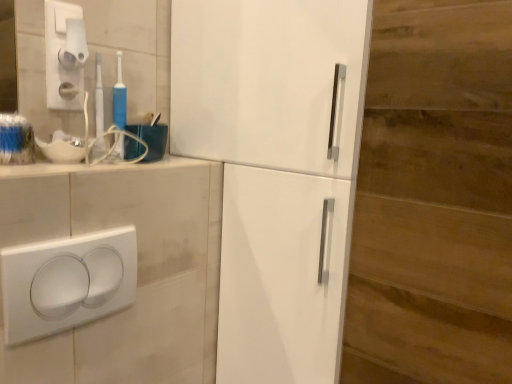
This screenshot has width=512, height=384. Find the location of `white plastic toothbrush at upper left, arranged as the 2th toothbrush when viewed from the right`. white plastic toothbrush at upper left, arranged as the 2th toothbrush when viewed from the right is located at coordinates (99, 110).

Locate an element on the screen. This screenshot has height=384, width=512. white glossy cabinet at center is located at coordinates (275, 170).

What do you see at coordinates (275, 170) in the screenshot?
I see `white glossy cabinet at center` at bounding box center [275, 170].

Describe the element at coordinates (65, 55) in the screenshot. The width and height of the screenshot is (512, 384). I see `white plastic light switch at upper left, marked as the 2th light switch in a front-to-back arrangement` at that location.

I want to click on white plastic/light switch at lower left, acting as the 1th light switch starting from the bottom, so click(x=67, y=282).

How distant is white plastic/light switch at lower left, which ranks as the second light switch in back-to-front order, from white plastic toothbrush at upper left, arranged as the 2th toothbrush when viewed from the right?

white plastic/light switch at lower left, which ranks as the second light switch in back-to-front order, is 10.43 inches away from white plastic toothbrush at upper left, arranged as the 2th toothbrush when viewed from the right.

Is white plastic/light switch at lower left, which ranks as the second light switch in back-to-front order, not close to white plastic toothbrush at upper left, arranged as the 2th toothbrush when viewed from the right?

white plastic/light switch at lower left, which ranks as the second light switch in back-to-front order, is actually quite close to white plastic toothbrush at upper left, arranged as the 2th toothbrush when viewed from the right.

Is point (117, 294) in front of point (101, 80)?

Yes, it is in front of point (101, 80).

In the scene shown: Between white plastic/light switch at lower left, which is counted as the first light switch, starting from the front, and white plastic toothbrush at upper left, arranged as the 2th toothbrush when viewed from the right, which one has less height?

With less height is white plastic/light switch at lower left, which is counted as the first light switch, starting from the front.

Is blue plastic toothbrush at upper left, the second toothbrush from the left, oriented away from white plastic/light switch at lower left, which is counted as the first light switch, starting from the front?

No, white plastic/light switch at lower left, which is counted as the first light switch, starting from the front, is not at the back of blue plastic toothbrush at upper left, the second toothbrush from the left.

Considering the relative sizes of blue plastic toothbrush at upper left, the second toothbrush from the left, and white plastic/light switch at lower left, which ranks as the second light switch in top-to-bottom order, in the image provided, is blue plastic toothbrush at upper left, the second toothbrush from the left, taller than white plastic/light switch at lower left, which ranks as the second light switch in top-to-bottom order,?

Correct, blue plastic toothbrush at upper left, the second toothbrush from the left, is much taller as white plastic/light switch at lower left, which ranks as the second light switch in top-to-bottom order.

Is point (120, 63) closer to camera compared to point (130, 272)?

No, it is not.

What are the coordinates of `the 1st toothbrush above the white plastic/light switch at lower left, acting as the 1th light switch starting from the bottom (from the image's perspective)` in the screenshot? It's located at (99, 110).

From a real-world perspective, which object stands above the other?

In real-world perspective, white plastic toothbrush at upper left, the 1th toothbrush viewed from the left, is above.

Looking at this image, from the image's perspective, between white plastic toothbrush at upper left, arranged as the 2th toothbrush when viewed from the right, and white plastic/light switch at lower left, which is counted as the first light switch, starting from the front, who is located below?

white plastic/light switch at lower left, which is counted as the first light switch, starting from the front, is shown below in the image.

Is white plastic toothbrush at upper left, arranged as the 2th toothbrush when viewed from the right, not close to white plastic/light switch at lower left, which is counted as the first light switch, starting from the front?

That's not correct — white plastic toothbrush at upper left, arranged as the 2th toothbrush when viewed from the right, is a little close to white plastic/light switch at lower left, which is counted as the first light switch, starting from the front.

Is white plastic light switch at upper left, the second light switch ordered from the bottom, not inside white glossy cabinet at center?

Yes, white plastic light switch at upper left, the second light switch ordered from the bottom, is outside of white glossy cabinet at center.

From a real-world perspective, which object rests below the other?

From a 3D spatial view, white glossy cabinet at center is below.

Find the location of a particular element. refrigerator in front of the white plastic light switch at upper left, arranged as the 1th light switch when viewed from the top is located at coordinates (275, 170).

Is the depth of white plastic/light switch at lower left, which ranks as the second light switch in top-to-bottom order, greater than that of white plastic light switch at upper left, marked as the 2th light switch in a front-to-back arrangement?

No, white plastic/light switch at lower left, which ranks as the second light switch in top-to-bottom order, is in front of white plastic light switch at upper left, marked as the 2th light switch in a front-to-back arrangement.

Which of these two, white plastic/light switch at lower left, acting as the 1th light switch starting from the bottom, or white plastic light switch at upper left, the second light switch ordered from the bottom, is smaller?

With smaller size is white plastic light switch at upper left, the second light switch ordered from the bottom.

Which of these two, white plastic/light switch at lower left, which ranks as the second light switch in top-to-bottom order, or white plastic light switch at upper left, the second light switch ordered from the bottom, is thinner?

Thinner between the two is white plastic light switch at upper left, the second light switch ordered from the bottom.

From the image's perspective, does white plastic/light switch at lower left, which ranks as the second light switch in back-to-front order, appear lower than white plastic light switch at upper left, marked as the 2th light switch in a front-to-back arrangement?

Yes, from the image's perspective, white plastic/light switch at lower left, which ranks as the second light switch in back-to-front order, is below white plastic light switch at upper left, marked as the 2th light switch in a front-to-back arrangement.

From a real-world perspective, is white glossy cabinet at center physically above white plastic/light switch at lower left, which ranks as the second light switch in back-to-front order?

Indeed, from a real-world perspective, white glossy cabinet at center stands above white plastic/light switch at lower left, which ranks as the second light switch in back-to-front order.

Between white glossy cabinet at center and white plastic/light switch at lower left, which ranks as the second light switch in top-to-bottom order, which one is positioned behind?

white glossy cabinet at center is further away from the camera.

Is white glossy cabinet at center facing away from white plastic/light switch at lower left, acting as the 1th light switch starting from the bottom?

Yes, white plastic/light switch at lower left, acting as the 1th light switch starting from the bottom, is at the back of white glossy cabinet at center.

Identify the location of the 2nd toothbrush below the white plastic light switch at upper left, arranged as the 1th light switch when viewed from the top (from the image's perspective). (99, 110).

Could you tell me if white plastic light switch at upper left, the second light switch ordered from the bottom, is turned towards white plastic toothbrush at upper left, arranged as the 2th toothbrush when viewed from the right?

No.

Can you tell me how much white plastic light switch at upper left, the first light switch viewed from the back, and white plastic toothbrush at upper left, arranged as the 2th toothbrush when viewed from the right, differ in facing direction?

The angle between the facing direction of white plastic light switch at upper left, the first light switch viewed from the back, and the facing direction of white plastic toothbrush at upper left, arranged as the 2th toothbrush when viewed from the right, is 1.95 degrees.

From the image's perspective, is white plastic light switch at upper left, marked as the 2th light switch in a front-to-back arrangement, above or below white plastic toothbrush at upper left, arranged as the 2th toothbrush when viewed from the right?

From the image's perspective, white plastic light switch at upper left, marked as the 2th light switch in a front-to-back arrangement, appears above white plastic toothbrush at upper left, arranged as the 2th toothbrush when viewed from the right.

Where is `light switch below the white plastic toothbrush at upper left, the 1th toothbrush viewed from the left (from the image's perspective)`? This screenshot has width=512, height=384. light switch below the white plastic toothbrush at upper left, the 1th toothbrush viewed from the left (from the image's perspective) is located at coordinates (67, 282).

Image resolution: width=512 pixels, height=384 pixels. Identify the location of the 2nd toothbrush above the white plastic/light switch at lower left, which is counted as the first light switch, starting from the front (from the image's perspective). (119, 97).

Which object lies further to the anchor point white glossy cabinet at center, white plastic toothbrush at upper left, arranged as the 2th toothbrush when viewed from the right, or blue plastic toothbrush at upper left, the second toothbrush from the left?

white plastic toothbrush at upper left, arranged as the 2th toothbrush when viewed from the right, is positioned further to the anchor white glossy cabinet at center.

Looking at this image, from the image, which object appears to be farther from white plastic/light switch at lower left, which ranks as the second light switch in back-to-front order, white plastic toothbrush at upper left, arranged as the 2th toothbrush when viewed from the right, or white plastic light switch at upper left, arranged as the 1th light switch when viewed from the top?

white plastic light switch at upper left, arranged as the 1th light switch when viewed from the top, is positioned further to the anchor white plastic/light switch at lower left, which ranks as the second light switch in back-to-front order.

Estimate the real-world distances between objects in this image. Which object is further from white plastic light switch at upper left, marked as the 2th light switch in a front-to-back arrangement, white glossy cabinet at center or beige ceramic counter top at upper left?

white glossy cabinet at center is positioned further to the anchor white plastic light switch at upper left, marked as the 2th light switch in a front-to-back arrangement.

Which object lies nearer to the anchor point blue plastic toothbrush at upper left, the second toothbrush from the left, white glossy cabinet at center or white plastic/light switch at lower left, which ranks as the second light switch in back-to-front order?

white plastic/light switch at lower left, which ranks as the second light switch in back-to-front order, is closer to blue plastic toothbrush at upper left, the second toothbrush from the left.

When comparing their distances from white glossy cabinet at center, does beige ceramic counter top at upper left or white plastic/light switch at lower left, which ranks as the second light switch in top-to-bottom order, seem closer?

Based on the image, beige ceramic counter top at upper left appears to be nearer to white glossy cabinet at center.

Looking at the image, which one is located further to blue plastic toothbrush at upper left, the second toothbrush from the left, white plastic/light switch at lower left, acting as the 1th light switch starting from the bottom, or beige ceramic counter top at upper left?

white plastic/light switch at lower left, acting as the 1th light switch starting from the bottom, lies further to blue plastic toothbrush at upper left, the second toothbrush from the left, than the other object.

Estimate the real-world distances between objects in this image. Which object is further from blue plastic toothbrush at upper left, the 1th toothbrush from the right, white glossy cabinet at center or white plastic toothbrush at upper left, arranged as the 2th toothbrush when viewed from the right?

Among the two, white glossy cabinet at center is located further to blue plastic toothbrush at upper left, the 1th toothbrush from the right.

Estimate the real-world distances between objects in this image. Which object is closer to white plastic/light switch at lower left, which ranks as the second light switch in back-to-front order, beige ceramic counter top at upper left or white plastic toothbrush at upper left, the 1th toothbrush viewed from the left?

Based on the image, beige ceramic counter top at upper left appears to be nearer to white plastic/light switch at lower left, which ranks as the second light switch in back-to-front order.

You are a GUI agent. You are given a task and a screenshot of the screen. Output one action in this format:
    pyautogui.click(x=<x>, y=<y>)
    Task: Click on the toothbrush between white plastic light switch at upper left, the second light switch ordered from the bottom, and blue plastic toothbrush at upper left, the 1th toothbrush from the right, in the front-back direction
    Image resolution: width=512 pixels, height=384 pixels.
    Given the screenshot: What is the action you would take?
    pyautogui.click(x=99, y=110)

This screenshot has height=384, width=512. What are the coordinates of `light switch between white plastic toothbrush at upper left, the 1th toothbrush viewed from the left, and white glossy cabinet at center` in the screenshot? It's located at (67, 282).

The image size is (512, 384). Find the location of `counter top that lies between blue plastic toothbrush at upper left, the 1th toothbrush from the right, and white plastic/light switch at lower left, which ranks as the second light switch in back-to-front order, from top to bottom`. counter top that lies between blue plastic toothbrush at upper left, the 1th toothbrush from the right, and white plastic/light switch at lower left, which ranks as the second light switch in back-to-front order, from top to bottom is located at coordinates (94, 167).

This screenshot has width=512, height=384. What are the coordinates of `toothbrush located between beige ceramic counter top at upper left and blue plastic toothbrush at upper left, the second toothbrush from the left, in the depth direction` in the screenshot? It's located at (99, 110).